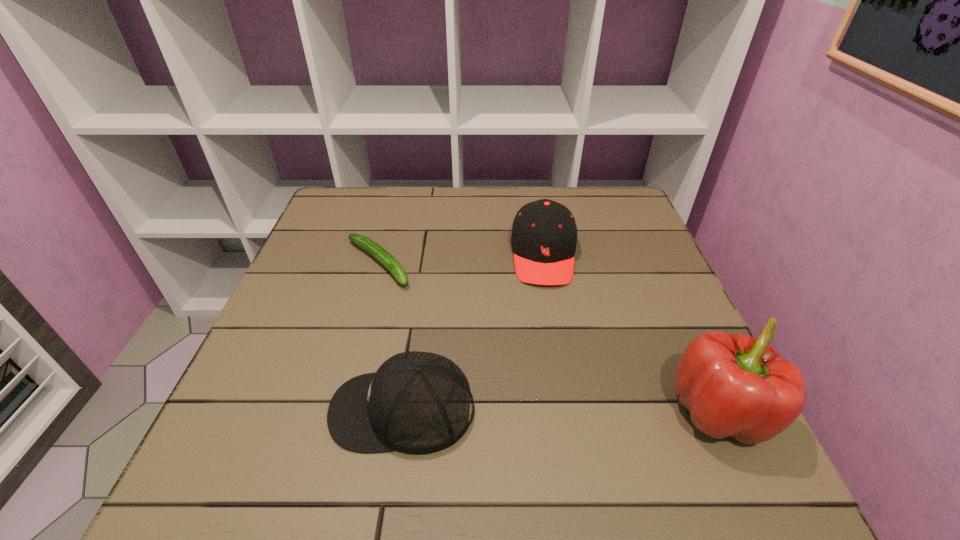
Locate an element on the screen. The image size is (960, 540). vacant area situated on the front-facing side of the shortest object is located at coordinates (457, 337).

Find the location of a particular element. vacant region located on the front-facing side of the shortest object is located at coordinates (415, 299).

The height and width of the screenshot is (540, 960). I want to click on free space located on the front-facing side of the right cap, so (551, 342).

Locate an element on the screen. The image size is (960, 540). free space located on the front-facing side of the right cap is located at coordinates (554, 388).

Image resolution: width=960 pixels, height=540 pixels. In order to click on vacant region located on the front-facing side of the right cap in this screenshot , I will do `click(549, 307)`.

The image size is (960, 540). Identify the location of object that is at the far edge. (544, 234).

This screenshot has height=540, width=960. What are the coordinates of `cap at the near edge` in the screenshot? It's located at (417, 403).

Where is `pepper that is at the near edge`? The width and height of the screenshot is (960, 540). pepper that is at the near edge is located at coordinates (736, 385).

At what (x,y) coordinates should I click in order to perform the action: click on object that is at the left edge. Please return your answer as a coordinate pair (x, y). Looking at the image, I should click on (376, 251).

Locate an element on the screen. The width and height of the screenshot is (960, 540). object present at the right edge is located at coordinates (736, 385).